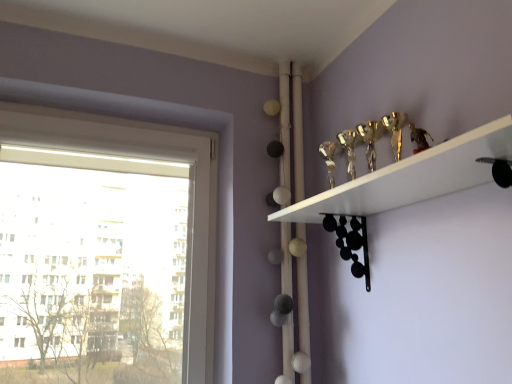
Find the location of a particular element. vacant region above white plastic window at left (from a real-world perspective) is located at coordinates (119, 112).